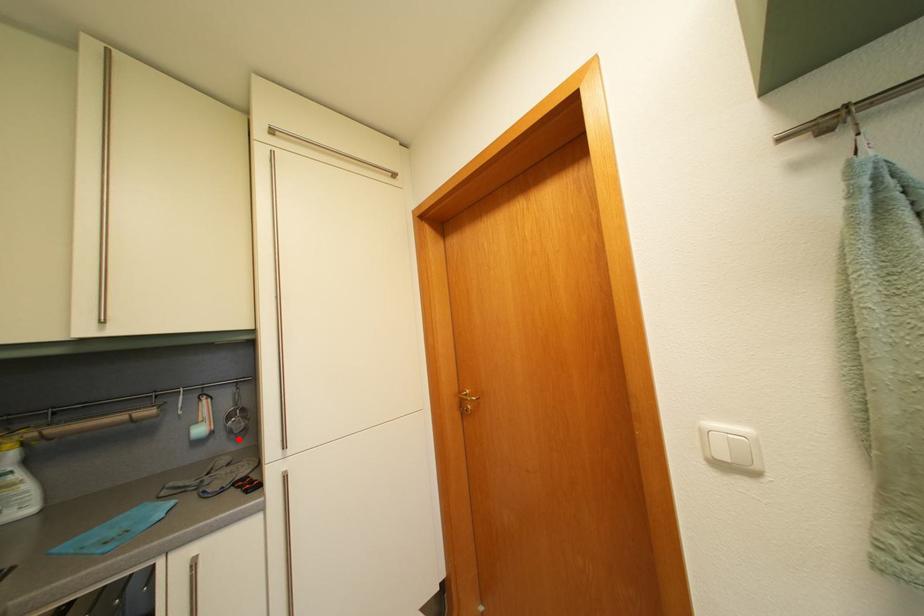
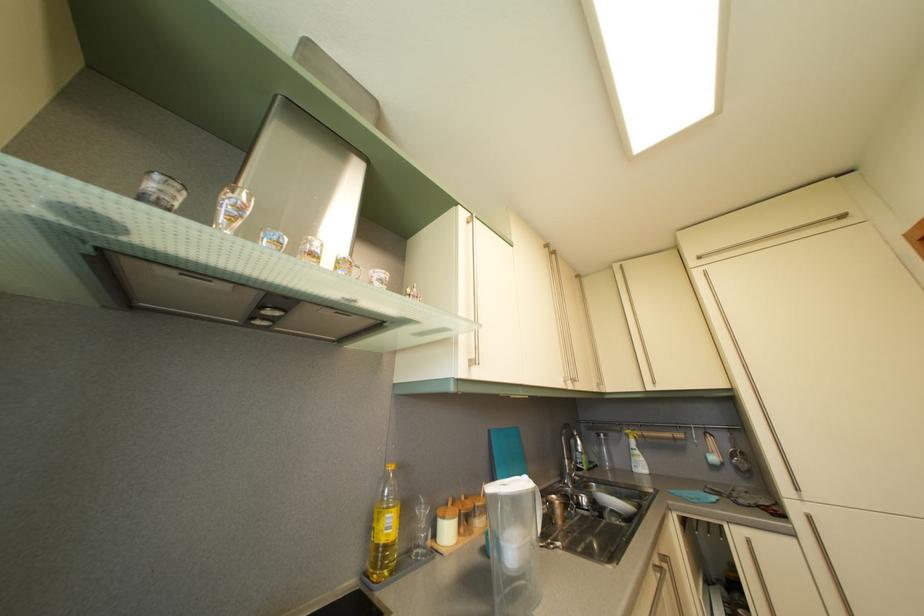
In the second image, find the point that corresponds to the highlighted location in the first image.

(746, 476)